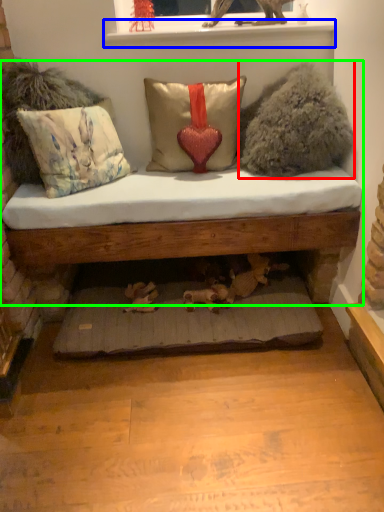
Question: Which object is the farthest from animal (highlighted by a red box)? Choose among these: window sill (highlighted by a blue box) or studio couch (highlighted by a green box).

Choices:
 (A) window sill
 (B) studio couch

Answer: (B)